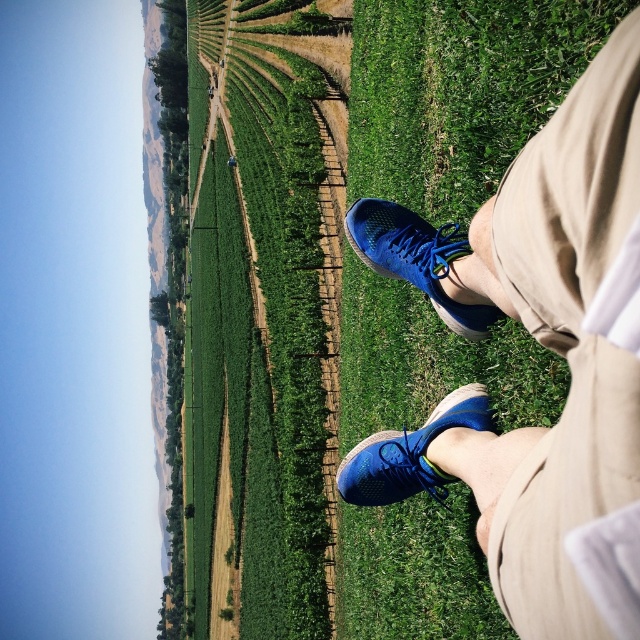
Which is above, green grass at center or blue mesh shoe at lower right?

blue mesh shoe at lower right is above.

Where is `green grass at center`? green grass at center is located at coordinates click(253, 330).

Does blue mesh sneakers at lower right appear over blue mesh shoe at lower center?

Yes.

At what (x,y) coordinates should I click in order to perform the action: click on blue mesh sneakers at lower right. Please return your answer as a coordinate pair (x, y). Looking at the image, I should click on (540, 342).

Where is `blue mesh sneakers at lower right`? The image size is (640, 640). blue mesh sneakers at lower right is located at coordinates (540, 342).

The image size is (640, 640). Find the location of `blue mesh sneakers at lower right`. blue mesh sneakers at lower right is located at coordinates (540, 342).

Is blue mesh shoe at lower right behind blue mesh shoe at lower center?

Yes.

Does blue mesh shoe at lower right have a smaller size compared to blue mesh shoe at lower center?

No, blue mesh shoe at lower right is not smaller than blue mesh shoe at lower center.

Based on the photo, who is more forward, (481, 324) or (477, 387)?

Positioned in front is point (481, 324).

This screenshot has width=640, height=640. I want to click on blue mesh shoe at lower right, so click(417, 257).